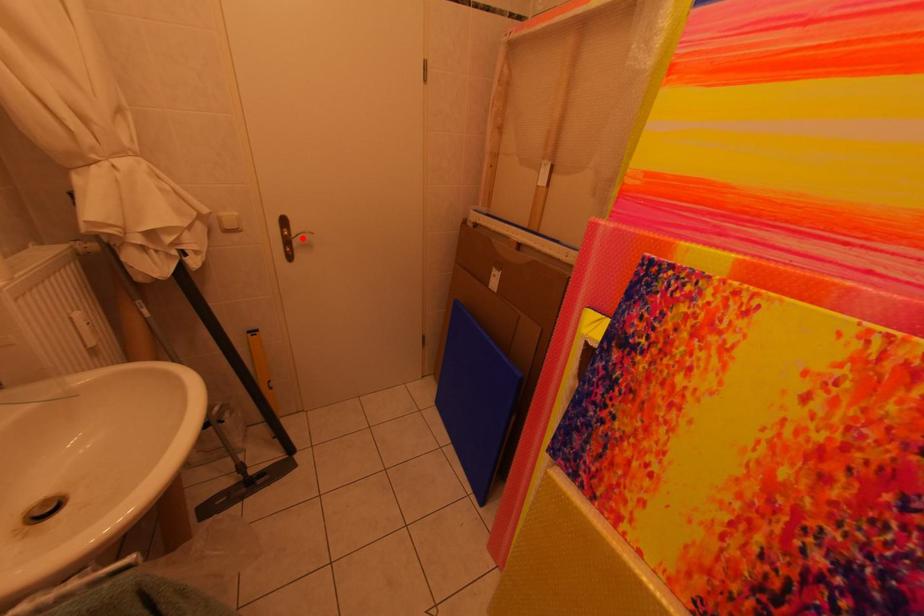
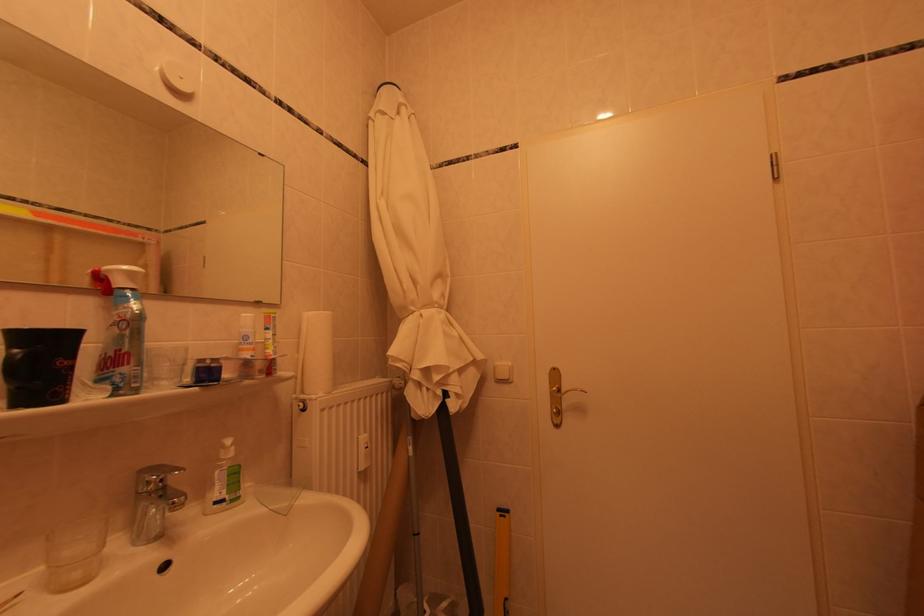
In the second image, find the point that corresponds to the highlighted location in the first image.

(572, 395)